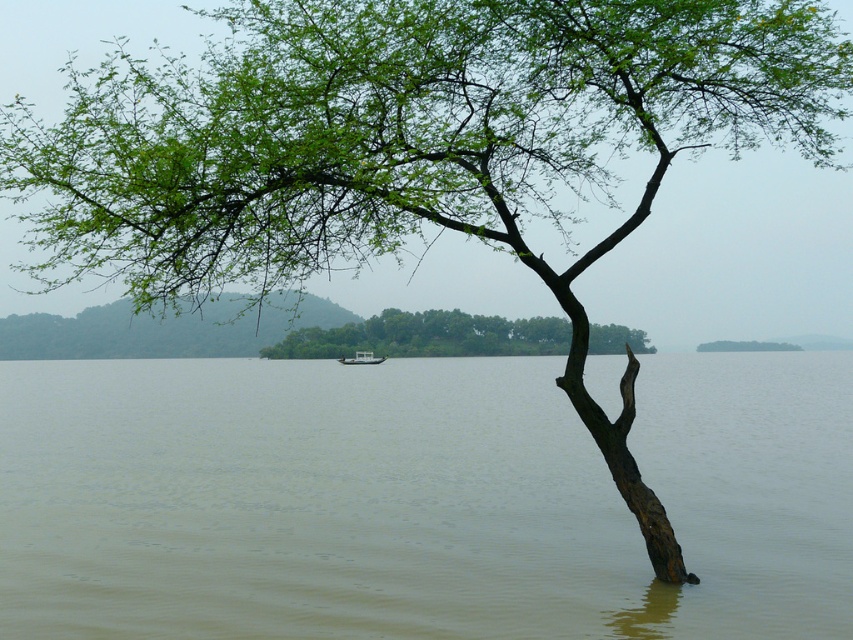
Describe the element at coordinates (418, 499) in the screenshot. The width and height of the screenshot is (853, 640). I see `brown murky water at center` at that location.

Is brown murky water at center above green leafy tree at center?

No.

Which is behind, point (688, 486) or point (755, 348)?

Point (755, 348)

Find the location of `brown murky water at center`. brown murky water at center is located at coordinates (418, 499).

Which is more to the left, brown rough tree trunk at center or green leafy tree at center?

Positioned to the left is brown rough tree trunk at center.

Based on the photo, who is more forward, (466, 349) or (752, 348)?

Point (466, 349) is in front.

At what (x,y) coordinates should I click in order to perform the action: click on brown rough tree trunk at center. Please return your answer as a coordinate pair (x, y). The image size is (853, 640). Looking at the image, I should click on (428, 337).

Is brown murky water at center above brown rough tree trunk at center?

Incorrect, brown murky water at center is not positioned above brown rough tree trunk at center.

Does point (718, 576) lie behind point (607, 346)?

No, (718, 576) is closer to viewer.

Is point (762, 358) farther from viewer compared to point (393, 346)?

Yes, it is behind point (393, 346).

The width and height of the screenshot is (853, 640). I want to click on brown murky water at center, so click(x=418, y=499).